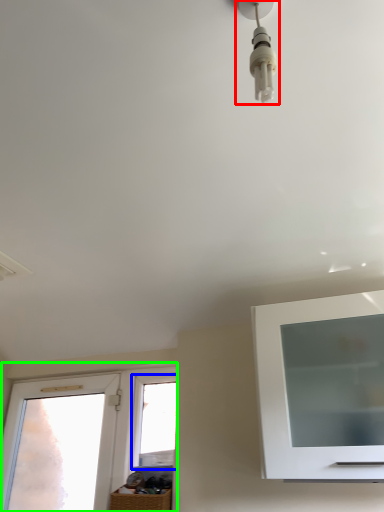
Question: Estimate the real-world distances between objects in this image. Which object is farther from light fixture (highlighted by a red box), window (highlighted by a blue box) or window (highlighted by a green box)?

Choices:
 (A) window
 (B) window

Answer: (B)